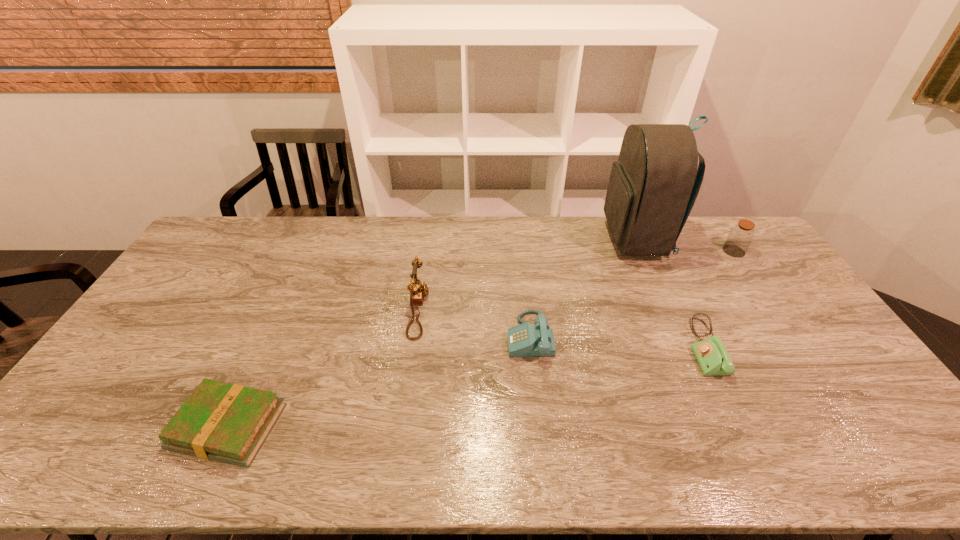
Where is `blank space located on the right of the nearest object`? blank space located on the right of the nearest object is located at coordinates (439, 427).

Identify the location of backpack that is at the far edge. (652, 189).

Where is `jar situated at the far edge`? jar situated at the far edge is located at coordinates (741, 235).

You are a GUI agent. You are given a task and a screenshot of the screen. Output one action in this format:
    pyautogui.click(x=<x>, y=<y>)
    Task: Click on the object at the near edge
    
    Given the screenshot: What is the action you would take?
    pyautogui.click(x=220, y=421)

Locate an element on the screen. Image resolution: width=960 pixels, height=540 pixels. object at the right edge is located at coordinates (741, 235).

Locate an element on the screen. object that is at the far right corner is located at coordinates (741, 235).

Where is `free space at the far edge of the desktop`? The width and height of the screenshot is (960, 540). free space at the far edge of the desktop is located at coordinates (415, 254).

Locate an element on the screen. Image resolution: width=960 pixels, height=540 pixels. free space at the left edge is located at coordinates (180, 320).

The height and width of the screenshot is (540, 960). In order to click on free space at the far right corner of the desktop in this screenshot , I will do `click(703, 225)`.

Identify the location of vacant space that's between the rightmost telephone and the jar. (719, 299).